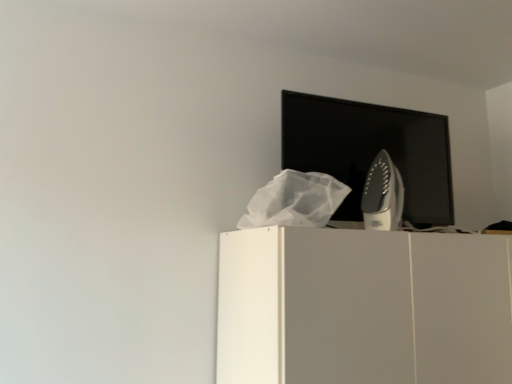
Question: Does satin silver iron at upper right come behind white matte cabinet at upper center?

Choices:
 (A) no
 (B) yes

Answer: (B)

Question: From a real-world perspective, is satin silver iron at upper right physically above white matte cabinet at upper center?

Choices:
 (A) no
 (B) yes

Answer: (B)

Question: Is satin silver iron at upper right surrounding white matte cabinet at upper center?

Choices:
 (A) no
 (B) yes

Answer: (A)

Question: Considering the relative positions of satin silver iron at upper right and white matte cabinet at upper center in the image provided, is satin silver iron at upper right in front of white matte cabinet at upper center?

Choices:
 (A) yes
 (B) no

Answer: (B)

Question: Is satin silver iron at upper right next to white matte cabinet at upper center and touching it?

Choices:
 (A) no
 (B) yes

Answer: (A)

Question: Based on their sizes in the image, would you say white matte cabinet at upper center is bigger or smaller than satin silver iron at upper right?

Choices:
 (A) big
 (B) small

Answer: (A)

Question: From the image's perspective, is white matte cabinet at upper center located above or below satin silver iron at upper right?

Choices:
 (A) above
 (B) below

Answer: (B)

Question: Relative to satin silver iron at upper right, is white matte cabinet at upper center in front or behind?

Choices:
 (A) behind
 (B) front

Answer: (B)

Question: Is white matte cabinet at upper center wider or thinner than satin silver iron at upper right?

Choices:
 (A) wide
 (B) thin

Answer: (A)

Question: From the image's perspective, is white matte cabinet at upper center above or below black glossy computer monitor at upper center?

Choices:
 (A) below
 (B) above

Answer: (A)

Question: Would you say white matte cabinet at upper center is to the left or to the right of black glossy computer monitor at upper center in the picture?

Choices:
 (A) right
 (B) left

Answer: (A)

Question: Is white matte cabinet at upper center inside or outside of black glossy computer monitor at upper center?

Choices:
 (A) inside
 (B) outside

Answer: (B)

Question: From a real-world perspective, relative to black glossy computer monitor at upper center, is white matte cabinet at upper center vertically above or below?

Choices:
 (A) above
 (B) below

Answer: (B)

Question: Based on their positions, is satin silver iron at upper right located to the left or right of black glossy computer monitor at upper center?

Choices:
 (A) right
 (B) left

Answer: (A)

Question: Is satin silver iron at upper right inside or outside of black glossy computer monitor at upper center?

Choices:
 (A) outside
 (B) inside

Answer: (A)